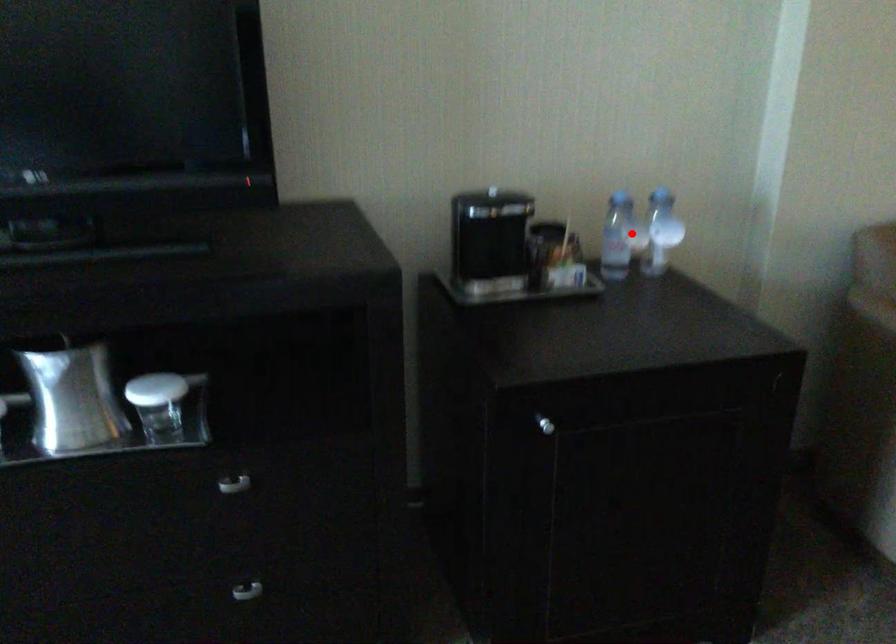
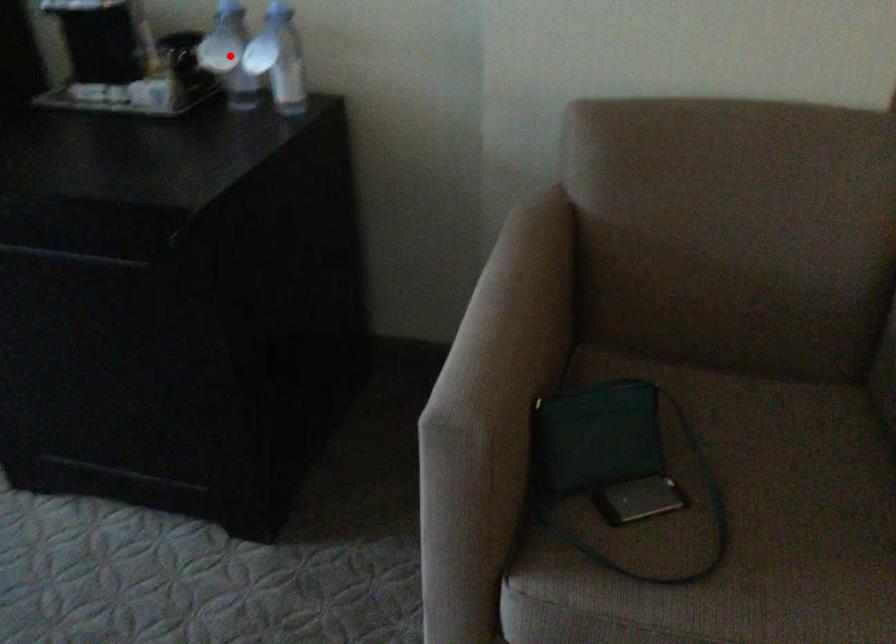
From the picture: I am providing you with two images of the same scene from different viewpoints. A red point is marked on the first image and another point is marked on the second image. Is the marked point in image1 the same physical position as the marked point in image2?

Yes